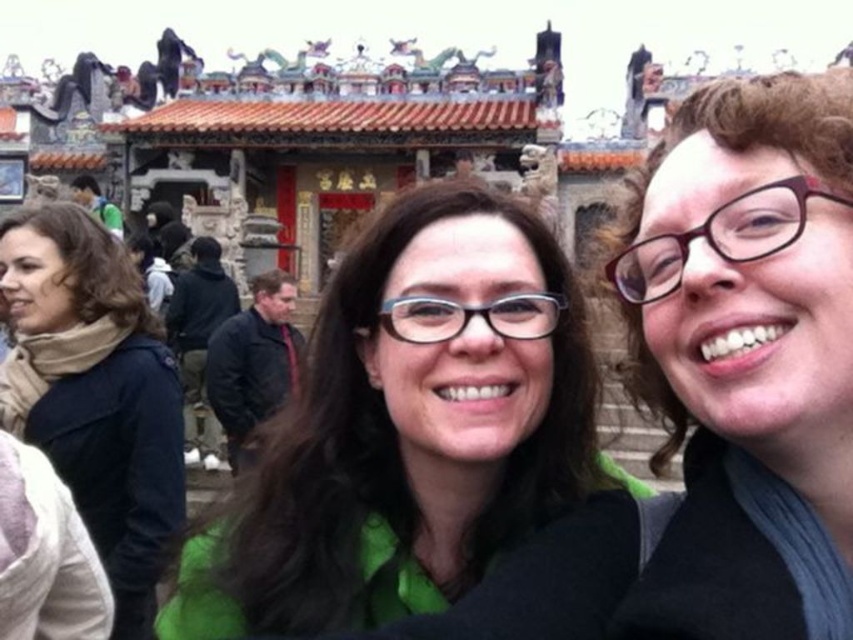
Is matte black glasses at upper right taller than beige scarf at left?

No, matte black glasses at upper right is not taller than beige scarf at left.

Between matte black glasses at upper right and beige scarf at left, which one has less height?

matte black glasses at upper right is shorter.

The height and width of the screenshot is (640, 853). What do you see at coordinates (746, 358) in the screenshot?
I see `matte black glasses at upper right` at bounding box center [746, 358].

Identify the location of matte black glasses at upper right. (746, 358).

Consider the image. Can you confirm if green matte shirt at center is positioned to the right of beige scarf at left?

Correct, you'll find green matte shirt at center to the right of beige scarf at left.

Does green matte shirt at center appear on the left side of beige scarf at left?

No, green matte shirt at center is not to the left of beige scarf at left.

Which is behind, point (364, 422) or point (172, 509)?

The point (172, 509) is behind.

You are a GUI agent. You are given a task and a screenshot of the screen. Output one action in this format:
    pyautogui.click(x=<x>, y=<y>)
    Task: Click on the green matte shirt at center
    This screenshot has width=853, height=640.
    Given the screenshot: What is the action you would take?
    [407, 429]

Who is shorter, green matte shirt at center or matte black glasses at upper right?

With less height is green matte shirt at center.

Between green matte shirt at center and matte black glasses at upper right, which one has more height?

matte black glasses at upper right

Where is `green matte shirt at center`? green matte shirt at center is located at coordinates (407, 429).

You are a GUI agent. You are given a task and a screenshot of the screen. Output one action in this format:
    pyautogui.click(x=<x>, y=<y>)
    Task: Click on the green matte shirt at center
    The image size is (853, 640).
    Given the screenshot: What is the action you would take?
    pyautogui.click(x=407, y=429)